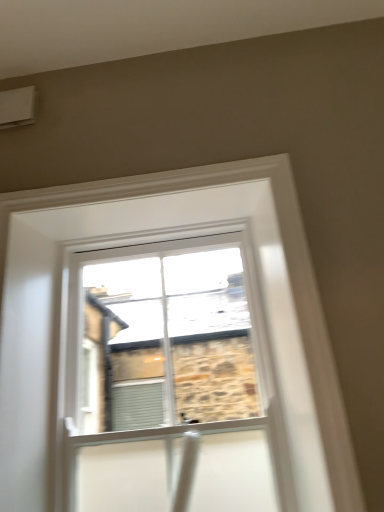
Question: From a real-world perspective, is white plastic air conditioning unit at upper left above or below clear glass window at center?

Choices:
 (A) above
 (B) below

Answer: (A)

Question: Choose the correct answer: Is white plastic air conditioning unit at upper left inside clear glass window at center or outside it?

Choices:
 (A) outside
 (B) inside

Answer: (A)

Question: Does point (4, 115) appear closer or farther from the camera than point (13, 329)?

Choices:
 (A) closer
 (B) farther

Answer: (B)

Question: Is clear glass window at center in front of or behind white plastic air conditioning unit at upper left in the image?

Choices:
 (A) behind
 (B) front

Answer: (B)

Question: From their relative heights in the image, would you say clear glass window at center is taller or shorter than white plastic air conditioning unit at upper left?

Choices:
 (A) tall
 (B) short

Answer: (A)

Question: Does point (61, 254) appear closer or farther from the camera than point (31, 90)?

Choices:
 (A) closer
 (B) farther

Answer: (B)

Question: From the image's perspective, relative to white plastic air conditioning unit at upper left, is clear glass window at center above or below?

Choices:
 (A) below
 (B) above

Answer: (A)